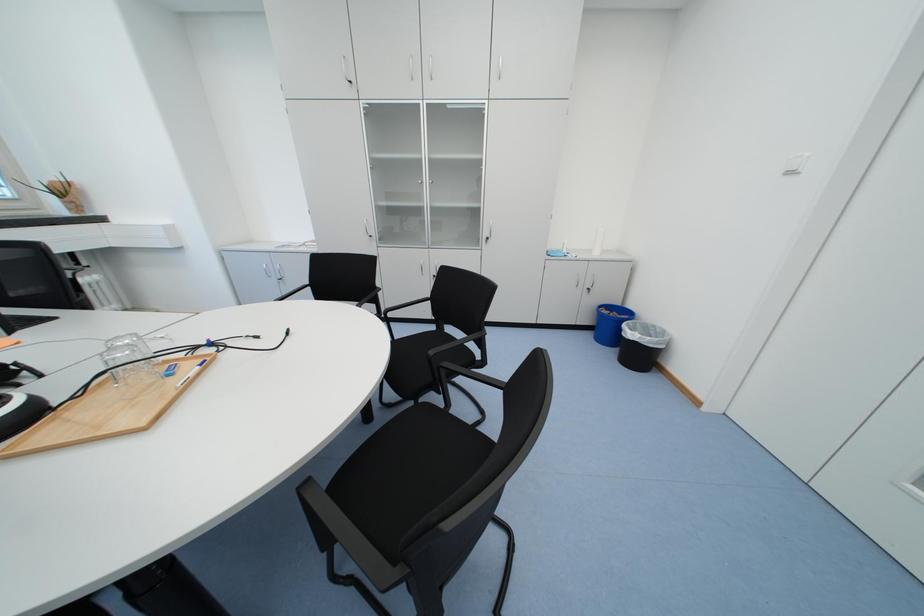
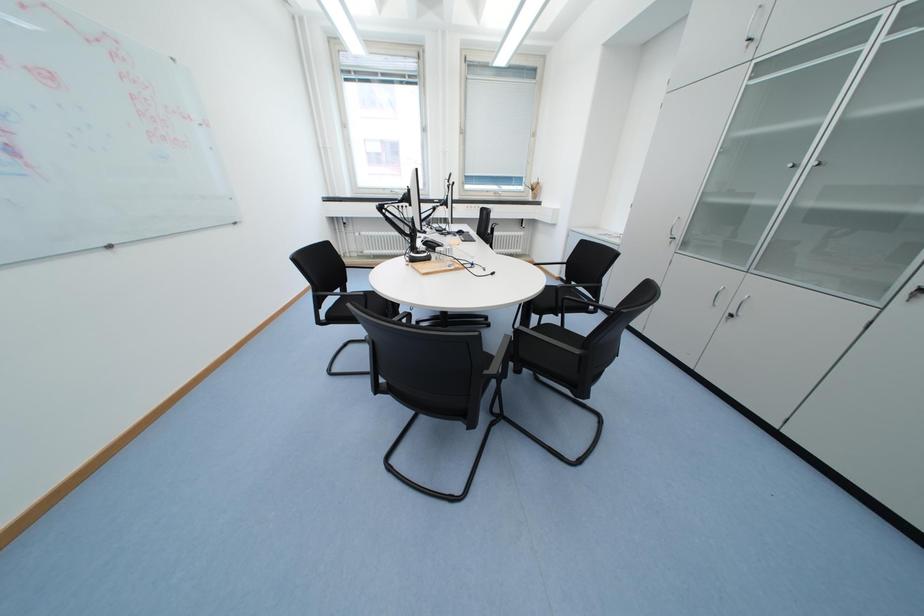
First-person continuous shooting, in which direction is the camera rotating?

The camera rotated toward left-down.